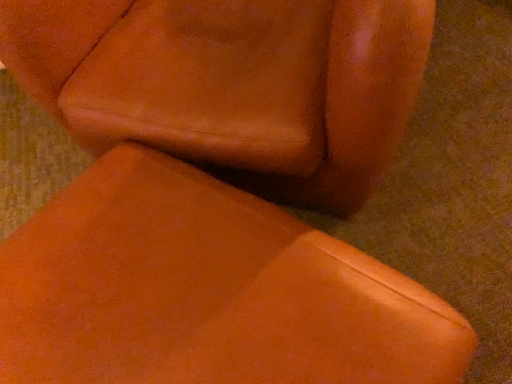
Question: Considering their positions, is leather chair at center, the 2th chair ordered from the bottom, located in front of or behind matte leather chair at center, the 1th chair in the bottom-to-top sequence?

Choices:
 (A) front
 (B) behind

Answer: (B)

Question: Is leather chair at center, arranged as the 1th chair when viewed from the top, spatially inside matte leather chair at center, the 1th chair in the bottom-to-top sequence, or outside of it?

Choices:
 (A) outside
 (B) inside

Answer: (A)

Question: Considering the positions of point [x=95, y=36] and point [x=223, y=359], is point [x=95, y=36] closer or farther from the camera than point [x=223, y=359]?

Choices:
 (A) closer
 (B) farther

Answer: (B)

Question: From a real-world perspective, is matte leather chair at center, the 1th chair in the bottom-to-top sequence, physically located above or below leather chair at center, arranged as the 1th chair when viewed from the top?

Choices:
 (A) below
 (B) above

Answer: (A)

Question: Is matte leather chair at center, the 1th chair in the bottom-to-top sequence, wider or thinner than leather chair at center, the 2th chair ordered from the bottom?

Choices:
 (A) thin
 (B) wide

Answer: (A)

Question: Considering the relative positions of matte leather chair at center, the 1th chair in the bottom-to-top sequence, and leather chair at center, the 2th chair ordered from the bottom, in the image provided, is matte leather chair at center, the 1th chair in the bottom-to-top sequence, to the left or to the right of leather chair at center, the 2th chair ordered from the bottom,?

Choices:
 (A) left
 (B) right

Answer: (A)

Question: Which is correct: matte leather chair at center, the 1th chair in the bottom-to-top sequence, is inside leather chair at center, the 2th chair ordered from the bottom, or outside of it?

Choices:
 (A) outside
 (B) inside

Answer: (A)